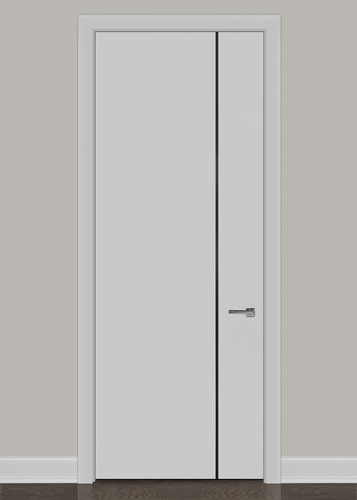
Identify the location of wall right of door. (328, 306).